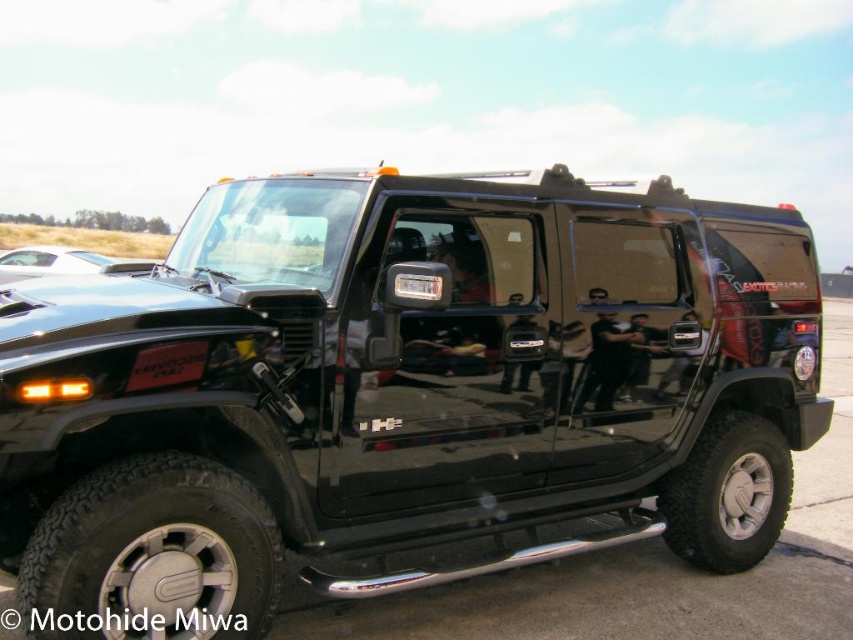
Who is more forward, (430, 179) or (165, 374)?

Point (165, 374) is more forward.

Can you confirm if glossy black suv at center is positioned to the right of black matte license plate at center?

Yes, glossy black suv at center is to the right of black matte license plate at center.

Which is behind, point (341, 493) or point (138, 381)?

The point (341, 493) is behind.

Image resolution: width=853 pixels, height=640 pixels. Find the location of `glossy black suv at center`. glossy black suv at center is located at coordinates (401, 392).

Based on the photo, does glossy black car at upper left come in front of black glossy license plate at center?

No.

Between glossy black car at upper left and black glossy license plate at center, which one is positioned lower?

Positioned lower is black glossy license plate at center.

Is point (38, 250) closer to viewer compared to point (426, 282)?

That is False.

This screenshot has width=853, height=640. What are the coordinates of `glossy black car at upper left` in the screenshot? It's located at (62, 262).

Who is positioned more to the left, black matte license plate at center or black glossy license plate at center?

From the viewer's perspective, black matte license plate at center appears more on the left side.

How distant is black matte license plate at center from black glossy license plate at center?

36.60 inches

Who is more forward, (151, 362) or (413, 291)?

Point (151, 362) is more forward.

The height and width of the screenshot is (640, 853). Identify the location of black matte license plate at center. (167, 364).